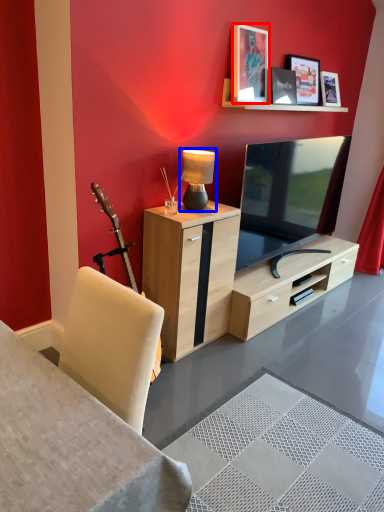
Question: Which point is further to the camera, picture frame (highlighted by a red box) or table lamp (highlighted by a blue box)?

Choices:
 (A) picture frame
 (B) table lamp

Answer: (A)